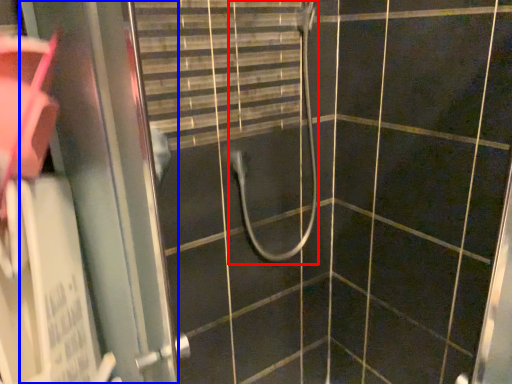
Question: Among these objects, which one is farthest to the camera, shower (highlighted by a red box) or screen door (highlighted by a blue box)?

Choices:
 (A) shower
 (B) screen door

Answer: (A)